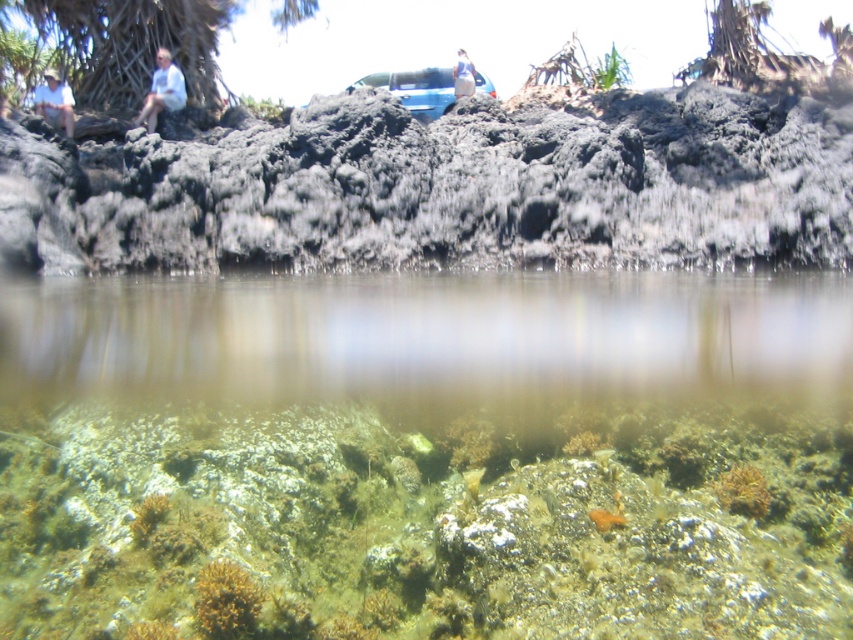
You are a snorkeler wearing a light blue shirt. You see a brown coral at lower center and a light blue shirt at upper left. Which object is closer to you?

The brown coral at lower center is closer to you because it is in front of the light blue shirt at upper left.

You are a snorkeler floating in the water. You see the brown coral at lower center and the light blue shirt at upper left. Which object is taller?

The light blue shirt at upper left is taller than the brown coral at lower center.

You are a swimmer looking at the two shirts at the upper left corner of the image. Which one is taller between the light blue shirt at upper left and the white shirt at upper left?

The light blue shirt at upper left is taller than the white shirt at upper left.